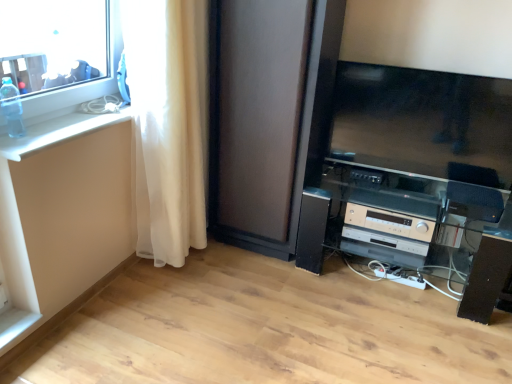
Image resolution: width=512 pixels, height=384 pixels. What are the coordinates of `vacant space behind transparent plastic bottle at upper left` in the screenshot? It's located at (48, 125).